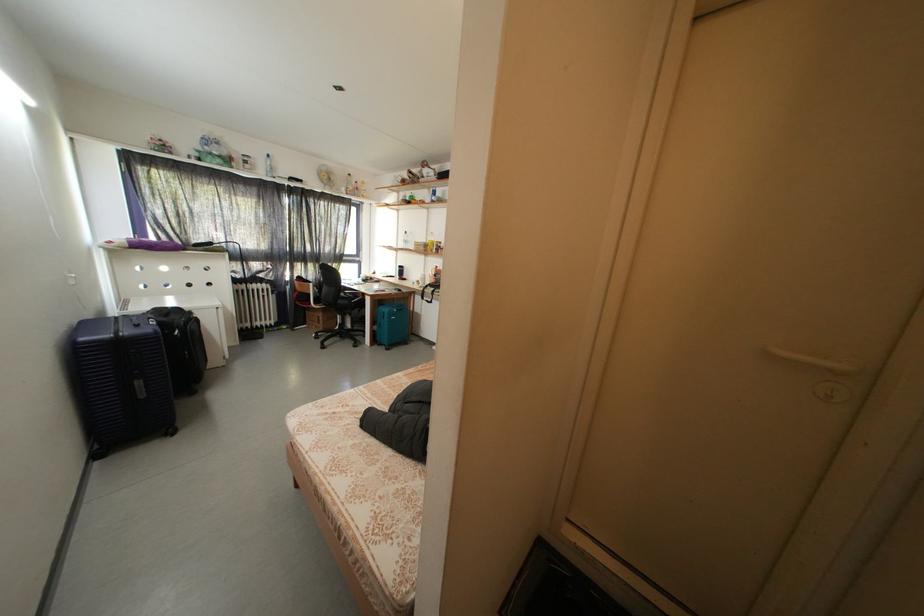
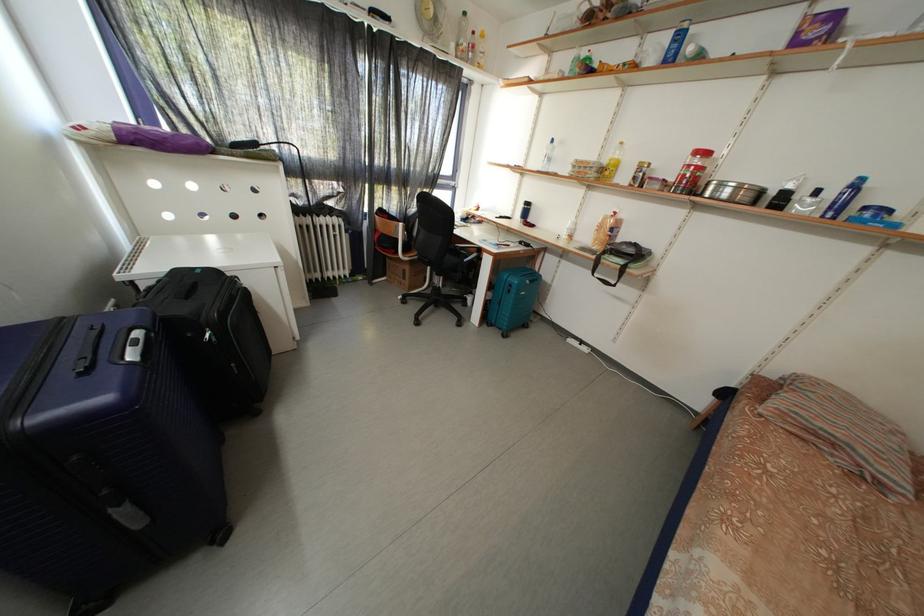
In a continuous first-person perspective shot, in which direction is the camera moving?

The cameraman moved toward left, forward.